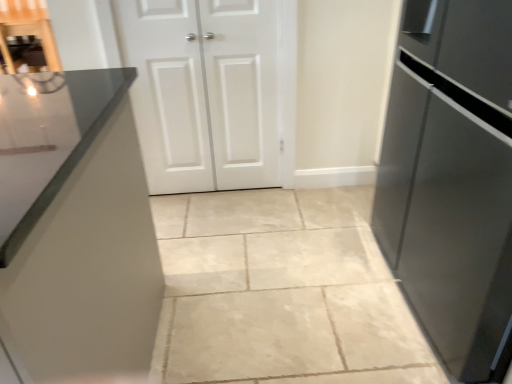
Question: In which direction should I rotate to look at white matte door at center, the second door viewed from the left?

Choices:
 (A) right
 (B) left

Answer: (B)

Question: Is white matte door at center, the second door viewed from the left, facing towards white matte cabinet doors at center, which is the 2th door in right-to-left order?

Choices:
 (A) no
 (B) yes

Answer: (B)

Question: Is white matte door at center, acting as the first door starting from the right, not within white matte cabinet doors at center, which is the 2th door in right-to-left order?

Choices:
 (A) no
 (B) yes

Answer: (A)

Question: Does white matte door at center, the second door viewed from the left, have a greater height compared to white matte cabinet doors at center, which is the 2th door in right-to-left order?

Choices:
 (A) yes
 (B) no

Answer: (B)

Question: Can you confirm if white matte door at center, acting as the first door starting from the right, is smaller than white matte cabinet doors at center, which is the 2th door in right-to-left order?

Choices:
 (A) yes
 (B) no

Answer: (A)

Question: Does white matte door at center, the second door viewed from the left, have a larger size compared to white matte cabinet doors at center, marked as the first door in a left-to-right arrangement?

Choices:
 (A) no
 (B) yes

Answer: (A)

Question: Is white matte door at center, acting as the first door starting from the right, closer to the viewer compared to white matte cabinet doors at center, which is the 2th door in right-to-left order?

Choices:
 (A) yes
 (B) no

Answer: (B)

Question: Is the position of white matte door at center, acting as the first door starting from the right, less distant than that of satin black refrigerator at right?

Choices:
 (A) yes
 (B) no

Answer: (B)

Question: Considering the relative sizes of white matte door at center, acting as the first door starting from the right, and satin black refrigerator at right in the image provided, is white matte door at center, acting as the first door starting from the right, smaller than satin black refrigerator at right?

Choices:
 (A) no
 (B) yes

Answer: (B)

Question: Is white matte door at center, the second door viewed from the left, outside satin black refrigerator at right?

Choices:
 (A) yes
 (B) no

Answer: (A)

Question: Does white matte door at center, the second door viewed from the left, touch satin black refrigerator at right?

Choices:
 (A) yes
 (B) no

Answer: (B)

Question: From a real-world perspective, is white matte door at center, the second door viewed from the left, physically above satin black refrigerator at right?

Choices:
 (A) no
 (B) yes

Answer: (A)

Question: Is satin black refrigerator at right inside white matte door at center, acting as the first door starting from the right?

Choices:
 (A) yes
 (B) no

Answer: (B)

Question: Can you confirm if satin black refrigerator at right is thinner than white matte cabinet doors at center, which is the 2th door in right-to-left order?

Choices:
 (A) yes
 (B) no

Answer: (B)